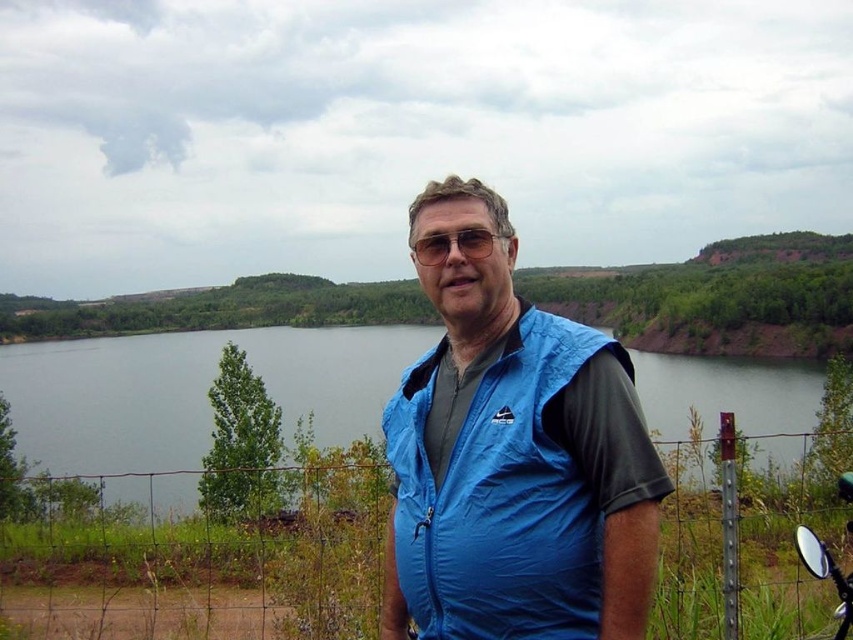
Which is above, blue fabric vest at center or clear plastic goggles at center?

Positioned higher is clear plastic goggles at center.

I want to click on blue fabric vest at center, so click(x=514, y=460).

Is point (815, 384) behind point (503, 236)?

Yes, it is behind point (503, 236).

Between point (161, 368) and point (463, 241), which one is positioned in front?

Point (463, 241) is more forward.

What do you see at coordinates (193, 390) in the screenshot? I see `blue water at center` at bounding box center [193, 390].

Identify the location of blue water at center. The width and height of the screenshot is (853, 640). (193, 390).

Does blue fabric vest at center have a larger size compared to blue water at center?

Actually, blue fabric vest at center might be smaller than blue water at center.

Who is more distant from viewer, (647, 554) or (45, 461)?

Positioned behind is point (45, 461).

Where is `blue fabric vest at center`? blue fabric vest at center is located at coordinates (514, 460).